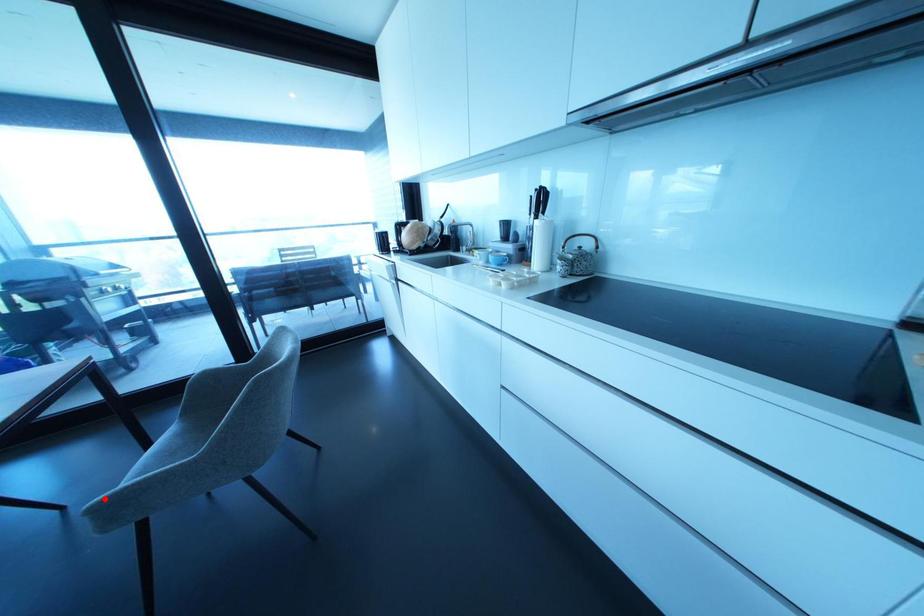
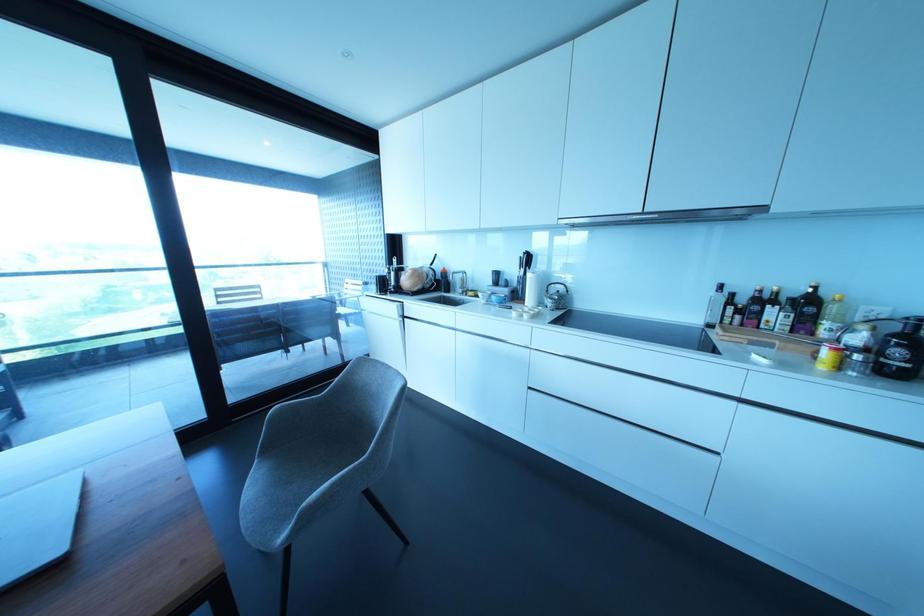
Find the pixel in the second image that matches the highlighted location in the first image.

(323, 493)